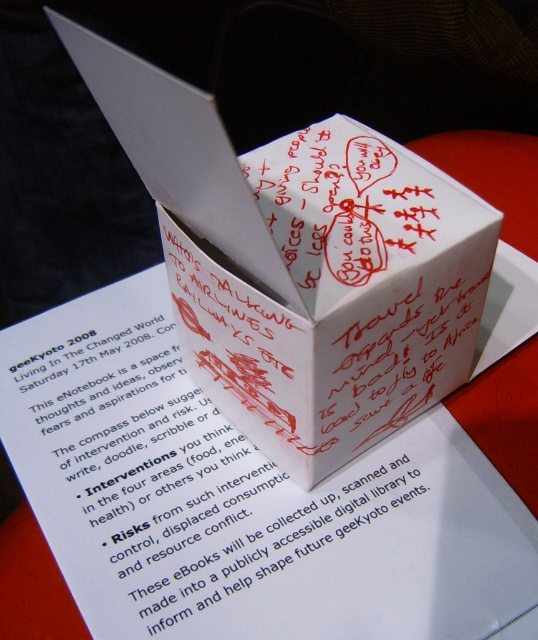
The image size is (538, 640). In order to click on white paper at center in this screenshot , I will do `click(242, 499)`.